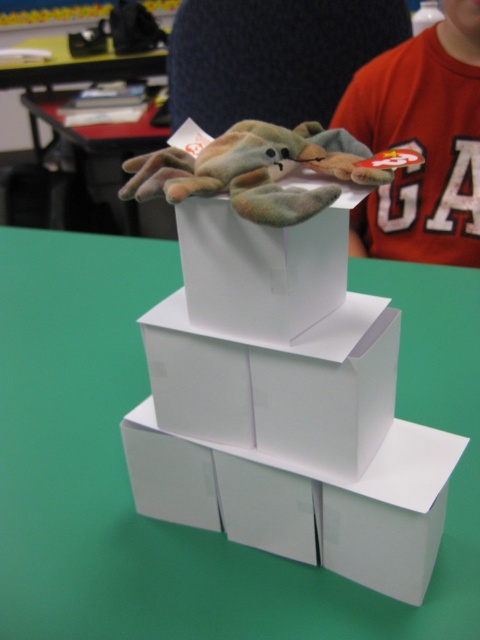
Who is positioned more to the left, white matte box at center or green plush toy at center?

From the viewer's perspective, green plush toy at center appears more on the left side.

Which is behind, point (244, 336) or point (247, 161)?

Point (244, 336)

Find the location of a particular element. The width and height of the screenshot is (480, 640). white matte box at center is located at coordinates [x=263, y=268].

Can you confirm if white cardboard boxes at center is thinner than white matte box at center?

In fact, white cardboard boxes at center might be wider than white matte box at center.

Between white cardboard boxes at center and white matte box at center, which one has less height?

Standing shorter between the two is white matte box at center.

Between point (441, 301) and point (196, 273), which one is positioned behind?

The point (441, 301) is more distant.

The image size is (480, 640). In order to click on white cardboard boxes at center in this screenshot , I will do `click(127, 472)`.

Between white cardboard boxes at center and red cotton shirt at upper center, which one appears on the right side from the viewer's perspective?

red cotton shirt at upper center is more to the right.

Does white cardboard boxes at center have a greater width compared to red cotton shirt at upper center?

Indeed, white cardboard boxes at center has a greater width compared to red cotton shirt at upper center.

Measure the distance between point (x=474, y=380) and camera.

A distance of 36.93 inches exists between point (x=474, y=380) and camera.

Locate an element on the screen. white cardboard boxes at center is located at coordinates (127, 472).